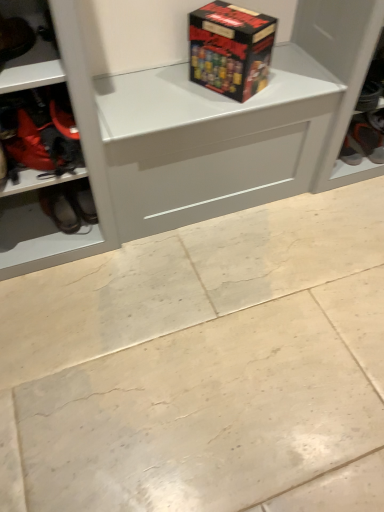
The height and width of the screenshot is (512, 384). I want to click on beige marble floor at center, so click(x=203, y=367).

In order to face beige marble floor at center, should I rotate leftwards or rightwards?

Rotate your view right by about 10.243°.

Describe the element at coordinates (14, 38) in the screenshot. I see `matte black shoe at left, the first footwear viewed from the left` at that location.

The image size is (384, 512). What do you see at coordinates (362, 142) in the screenshot? I see `orange fabric shoe at right, the 4th footwear in the left-to-right sequence` at bounding box center [362, 142].

What is the approximate height of matt black box at upper center?

It is 8.50 inches.

Find the location of a particular element. black leather shoes at lower left, which is the 3th footwear in front-to-back order is located at coordinates (67, 205).

Can we say beige marble floor at center lies outside matt black box at upper center?

beige marble floor at center is positioned outside matt black box at upper center.

Looking at this image, is beige marble floor at center to the left or to the right of matt black box at upper center in the image?

In the image, beige marble floor at center appears on the right side of matt black box at upper center.

What's the angular difference between beige marble floor at center and matt black box at upper center's facing directions?

151 degrees separate the facing orientations of beige marble floor at center and matt black box at upper center.

Does point (330, 481) come in front of point (191, 47)?

Yes, it is in front of point (191, 47).

Is matt black box at upper center at the right side of black leather shoes at lower left, the third footwear in the right-to-left sequence?

Yes.

Based on the photo, is matt black box at upper center next to black leather shoes at lower left, placed as the 2th footwear when sorted from left to right?

matt black box at upper center is not next to black leather shoes at lower left, placed as the 2th footwear when sorted from left to right, and they're not touching.

From a real-world perspective, relative to black leather shoes at lower left, the third footwear in the right-to-left sequence, is matt black box at upper center vertically above or below?

From a real-world perspective, matt black box at upper center is physically above black leather shoes at lower left, the third footwear in the right-to-left sequence.

How different are the orientations of matt black box at upper center and black leather shoes at lower left, which is the 3th footwear in front-to-back order, in degrees?

81.6 degrees.

From a real-world perspective, does matte black shoe at left, which ranks as the 4th footwear in back-to-front order, stand above black leather shoes at lower left, placed as the 2th footwear when sorted from left to right?

Yes, from a real-world perspective, matte black shoe at left, which ranks as the 4th footwear in back-to-front order, is over black leather shoes at lower left, placed as the 2th footwear when sorted from left to right

What's the angular difference between matte black shoe at left, which ranks as the 4th footwear in back-to-front order, and black leather shoes at lower left, which is the 3th footwear in front-to-back order,'s facing directions?

52.4 degrees.

The width and height of the screenshot is (384, 512). Find the location of `footwear on the left side of black leather shoes at lower left, positioned as the 2th footwear in back-to-front order`. footwear on the left side of black leather shoes at lower left, positioned as the 2th footwear in back-to-front order is located at coordinates (14, 38).

Which is less distant, (12, 38) or (46, 204)?

Clearly, point (12, 38) is closer to the camera than point (46, 204).

Consider the image. Which of these two, red fabric boot at left, marked as the third footwear in a left-to-right arrangement, or black leather shoes at lower left, the third footwear in the right-to-left sequence, is wider?

red fabric boot at left, marked as the third footwear in a left-to-right arrangement.

From a real-world perspective, is red fabric boot at left, which appears as the 3th footwear when viewed from the back, physically located above or below black leather shoes at lower left, placed as the 2th footwear when sorted from left to right?

In terms of real-world spatial position, red fabric boot at left, which appears as the 3th footwear when viewed from the back, is above black leather shoes at lower left, placed as the 2th footwear when sorted from left to right.

I want to click on footwear that is the 1st object located behind the red fabric boot at left, marked as the third footwear in a left-to-right arrangement, so click(x=67, y=205).

Is the depth of red fabric boot at left, marked as the third footwear in a left-to-right arrangement, greater than that of black leather shoes at lower left, the third footwear in the right-to-left sequence?

No, red fabric boot at left, marked as the third footwear in a left-to-right arrangement, is closer to the camera.

In the scene shown: From a real-world perspective, is red fabric boot at left, placed as the 2th footwear when sorted from right to left, positioned under orange fabric shoe at right, which is counted as the 4th footwear, starting from the front, based on gravity?

No, from a real-world perspective, red fabric boot at left, placed as the 2th footwear when sorted from right to left, is not under orange fabric shoe at right, which is counted as the 4th footwear, starting from the front.

From the picture: Is red fabric boot at left, marked as the third footwear in a left-to-right arrangement, to the right of orange fabric shoe at right, which ranks as the 1th footwear in right-to-left order, from the viewer's perspective?

Incorrect, red fabric boot at left, marked as the third footwear in a left-to-right arrangement, is not on the right side of orange fabric shoe at right, which ranks as the 1th footwear in right-to-left order.

Considering the relative sizes of red fabric boot at left, which appears as the 3th footwear when viewed from the back, and orange fabric shoe at right, which ranks as the 1th footwear in right-to-left order, in the image provided, is red fabric boot at left, which appears as the 3th footwear when viewed from the back, bigger than orange fabric shoe at right, which ranks as the 1th footwear in right-to-left order,?

Yes, red fabric boot at left, which appears as the 3th footwear when viewed from the back, is bigger than orange fabric shoe at right, which ranks as the 1th footwear in right-to-left order.

Can you tell me how much red fabric boot at left, which appears as the 3th footwear when viewed from the back, and orange fabric shoe at right, which ranks as the 1th footwear in right-to-left order, differ in facing direction?

The facing directions of red fabric boot at left, which appears as the 3th footwear when viewed from the back, and orange fabric shoe at right, which ranks as the 1th footwear in right-to-left order, are 3.64 degrees apart.

Is black leather shoes at lower left, placed as the 2th footwear when sorted from left to right, facing away from matte black shoe at left, which is the 4th footwear from right to left?

No, black leather shoes at lower left, placed as the 2th footwear when sorted from left to right, is not facing the opposite direction of matte black shoe at left, which is the 4th footwear from right to left.

Is matte black shoe at left, the first footwear viewed from the left, surrounded by black leather shoes at lower left, placed as the 2th footwear when sorted from left to right?

That's incorrect, matte black shoe at left, the first footwear viewed from the left, is not inside black leather shoes at lower left, placed as the 2th footwear when sorted from left to right.

Are black leather shoes at lower left, which is the 3th footwear in front-to-back order, and matte black shoe at left, marked as the first footwear in a front-to-back arrangement, located far from each other?

No, black leather shoes at lower left, which is the 3th footwear in front-to-back order, is in close proximity to matte black shoe at left, marked as the first footwear in a front-to-back arrangement.

Considering the sizes of objects black leather shoes at lower left, positioned as the 2th footwear in back-to-front order, and matte black shoe at left, which is the 4th footwear from right to left, in the image provided, who is bigger, black leather shoes at lower left, positioned as the 2th footwear in back-to-front order, or matte black shoe at left, which is the 4th footwear from right to left,?

Bigger between the two is matte black shoe at left, which is the 4th footwear from right to left.

Which object is thinner, orange fabric shoe at right, which ranks as the 1th footwear in right-to-left order, or matt black box at upper center?

matt black box at upper center is thinner.

Considering the sizes of orange fabric shoe at right, the 1th footwear when ordered from back to front, and matt black box at upper center in the image, is orange fabric shoe at right, the 1th footwear when ordered from back to front, taller or shorter than matt black box at upper center?

In the image, orange fabric shoe at right, the 1th footwear when ordered from back to front, appears to be shorter than matt black box at upper center.

Between point (355, 121) and point (233, 83), which one is positioned in front?

Point (233, 83)

Who is bigger, orange fabric shoe at right, the 1th footwear when ordered from back to front, or matt black box at upper center?

matt black box at upper center.

Where is `concrete that appears on the right of matt black box at upper center`? concrete that appears on the right of matt black box at upper center is located at coordinates (203, 367).

Which footwear is the 1st one when counting from the back of the matt black box at upper center? Please provide its 2D coordinates.

[(67, 205)]

Looking at the image, which one is located closer to red fabric boot at left, marked as the third footwear in a left-to-right arrangement, orange fabric shoe at right, the 1th footwear when ordered from back to front, or matte black shoe at left, the first footwear viewed from the left?

matte black shoe at left, the first footwear viewed from the left.

Looking at the image, which one is located closer to matt black box at upper center, red fabric boot at left, marked as the third footwear in a left-to-right arrangement, or beige marble floor at center?

red fabric boot at left, marked as the third footwear in a left-to-right arrangement, is positioned closer to the anchor matt black box at upper center.

Which object lies further to the anchor point black leather shoes at lower left, the third footwear in the right-to-left sequence, matt black box at upper center or orange fabric shoe at right, which is counted as the 4th footwear, starting from the front?

The object further to black leather shoes at lower left, the third footwear in the right-to-left sequence, is orange fabric shoe at right, which is counted as the 4th footwear, starting from the front.

From the picture: Looking at the image, which one is located closer to black leather shoes at lower left, positioned as the 2th footwear in back-to-front order, matt black box at upper center or red fabric boot at left, acting as the 2th footwear starting from the front?

red fabric boot at left, acting as the 2th footwear starting from the front, is closer to black leather shoes at lower left, positioned as the 2th footwear in back-to-front order.

When comparing their distances from matt black box at upper center, does beige marble floor at center or black leather shoes at lower left, positioned as the 2th footwear in back-to-front order, seem further?

Based on the image, beige marble floor at center appears to be further to matt black box at upper center.

Which object lies nearer to the anchor point black leather shoes at lower left, positioned as the 2th footwear in back-to-front order, red fabric boot at left, which appears as the 3th footwear when viewed from the back, or matte black shoe at left, which ranks as the 4th footwear in back-to-front order?

red fabric boot at left, which appears as the 3th footwear when viewed from the back.

From the image, which object appears to be nearer to matte black shoe at left, the first footwear viewed from the left, beige marble floor at center or orange fabric shoe at right, the 1th footwear when ordered from back to front?

Among the two, beige marble floor at center is located nearer to matte black shoe at left, the first footwear viewed from the left.

Considering their positions, is matte black shoe at left, which is the 4th footwear from right to left, positioned closer to red fabric boot at left, placed as the 2th footwear when sorted from right to left, than black leather shoes at lower left, positioned as the 2th footwear in back-to-front order?

matte black shoe at left, which is the 4th footwear from right to left, is positioned closer to the anchor red fabric boot at left, placed as the 2th footwear when sorted from right to left.

I want to click on footwear between black leather shoes at lower left, placed as the 2th footwear when sorted from left to right, and matt black box at upper center, in the horizontal direction, so click(x=40, y=131).

This screenshot has height=512, width=384. I want to click on box situated between black leather shoes at lower left, the third footwear in the right-to-left sequence, and orange fabric shoe at right, which is counted as the 4th footwear, starting from the front, from left to right, so click(x=230, y=49).

Locate an element on the screen. The image size is (384, 512). concrete between matte black shoe at left, which ranks as the 4th footwear in back-to-front order, and orange fabric shoe at right, which ranks as the 1th footwear in right-to-left order, in the horizontal direction is located at coordinates (203, 367).

Locate an element on the screen. The image size is (384, 512). box located between beige marble floor at center and orange fabric shoe at right, which ranks as the 1th footwear in right-to-left order, in the depth direction is located at coordinates [230, 49].